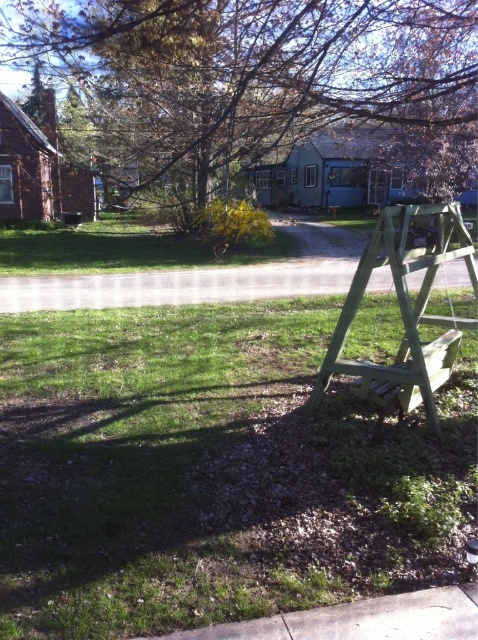
You are standing at the edge of the sidewalk and want to walk towards the green wood ladder at right. Which direction should you move to first reach the green grass at lower center before the ladder?

You should move towards the green grass at lower center first because it is closer to the viewer than the green wood ladder at right.

You are standing at the point labeled as point (210,472) in the image. What is the color of the ground beneath you?

The point (210,472) corresponds to green grass at lower center, so the ground beneath you is green grass.